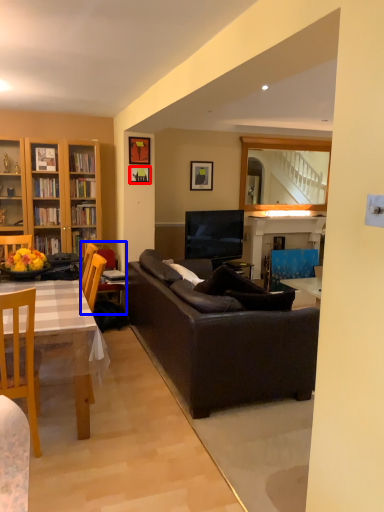
Question: Which of the following is the farthest to the observer, picture frame (highlighted by a red box) or armchair (highlighted by a blue box)?

Choices:
 (A) picture frame
 (B) armchair

Answer: (A)